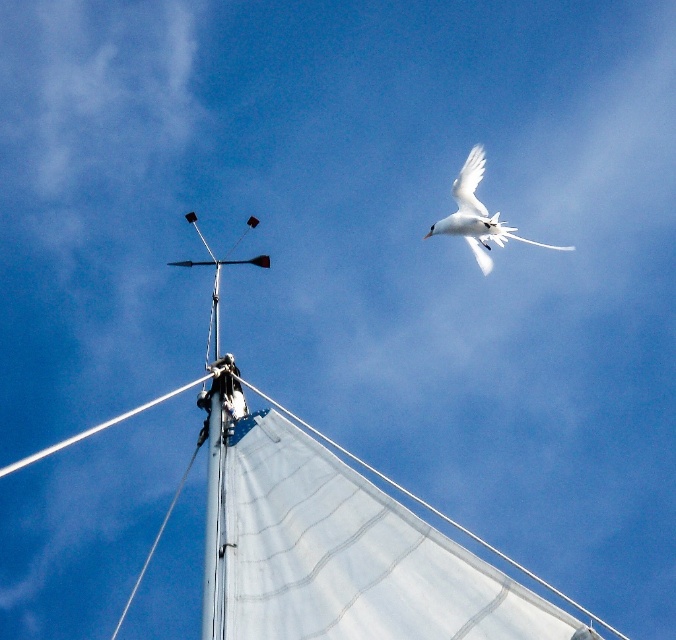
Question: Is white fabric sailboat at upper center smaller than white feathered bird at upper right?

Choices:
 (A) yes
 (B) no

Answer: (B)

Question: Which object is farther from the camera taking this photo?

Choices:
 (A) white feathered bird at upper right
 (B) white fabric sailboat at upper center

Answer: (A)

Question: Is white fabric sailboat at upper center positioned at the back of white feathered bird at upper right?

Choices:
 (A) yes
 (B) no

Answer: (B)

Question: Is white fabric sailboat at upper center below white feathered bird at upper right?

Choices:
 (A) no
 (B) yes

Answer: (B)

Question: Which point is closer to the camera?

Choices:
 (A) (475, 241)
 (B) (203, 428)

Answer: (B)